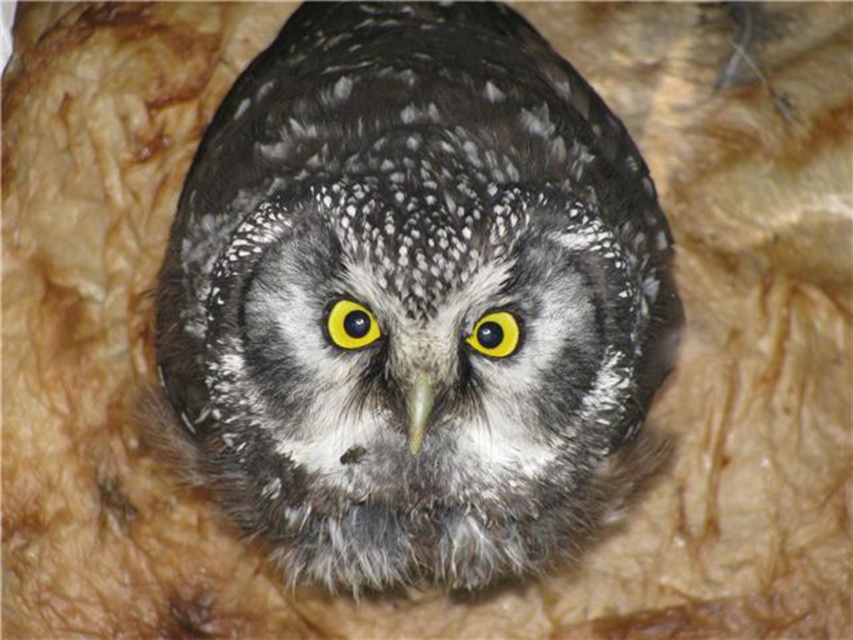
Question: In this image, where is speckled feathered owl at center located relative to yellow shiny eye at center?

Choices:
 (A) above
 (B) below

Answer: (A)

Question: Among these objects, which one is farthest from the camera?

Choices:
 (A) speckled feathered owl at center
 (B) yellow matte eye at center
 (C) yellow shiny eye at center
 (D) green matte beak at center

Answer: (B)

Question: Is yellow shiny eye at center above green matte beak at center?

Choices:
 (A) yes
 (B) no

Answer: (A)

Question: Estimate the real-world distances between objects in this image. Which object is farther from the yellow matte eye at center?

Choices:
 (A) yellow shiny eye at center
 (B) speckled feathered owl at center

Answer: (B)

Question: Does speckled feathered owl at center appear over yellow matte eye at center?

Choices:
 (A) no
 (B) yes

Answer: (B)

Question: Which of the following is the farthest from the observer?

Choices:
 (A) (247, 323)
 (B) (352, 349)
 (C) (410, 419)
 (D) (514, 352)

Answer: (A)